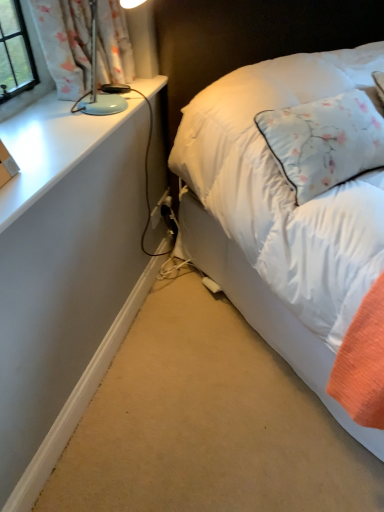
Question: Should I look upward or downward to see white soft bed at right?

Choices:
 (A) up
 (B) down

Answer: (A)

Question: From the image's perspective, is matte blue lamp at upper left on white matte desk at lower left?

Choices:
 (A) no
 (B) yes

Answer: (B)

Question: Is white matte desk at lower left located within matte blue lamp at upper left?

Choices:
 (A) no
 (B) yes

Answer: (A)

Question: Is matte blue lamp at upper left looking in the opposite direction of white matte desk at lower left?

Choices:
 (A) yes
 (B) no

Answer: (B)

Question: Does matte blue lamp at upper left lie behind white matte desk at lower left?

Choices:
 (A) yes
 (B) no

Answer: (B)

Question: Can you confirm if matte blue lamp at upper left is bigger than white matte desk at lower left?

Choices:
 (A) no
 (B) yes

Answer: (B)

Question: Does matte blue lamp at upper left come in front of white matte desk at lower left?

Choices:
 (A) yes
 (B) no

Answer: (A)

Question: Is white matte desk at lower left not inside matte blue lamp at upper left?

Choices:
 (A) yes
 (B) no

Answer: (A)

Question: Is white matte desk at lower left facing towards matte blue lamp at upper left?

Choices:
 (A) no
 (B) yes

Answer: (A)

Question: Can you confirm if white matte desk at lower left is wider than matte blue lamp at upper left?

Choices:
 (A) yes
 (B) no

Answer: (B)

Question: From a real-world perspective, is white matte desk at lower left physically above matte blue lamp at upper left?

Choices:
 (A) yes
 (B) no

Answer: (B)

Question: Considering the relative sizes of white matte desk at lower left and matte blue lamp at upper left in the image provided, is white matte desk at lower left bigger than matte blue lamp at upper left?

Choices:
 (A) no
 (B) yes

Answer: (A)

Question: Is the surface of white matte desk at lower left in direct contact with matte blue lamp at upper left?

Choices:
 (A) yes
 (B) no

Answer: (B)

Question: Does matte blue lamp at upper left have a greater height compared to white soft bed at right?

Choices:
 (A) no
 (B) yes

Answer: (A)